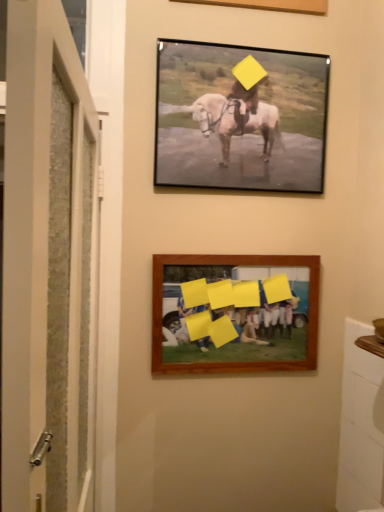
Question: From their relative heights in the image, would you say white textured door at left is taller or shorter than matte black frame at upper center, the 2th picture frame ordered from the bottom?

Choices:
 (A) tall
 (B) short

Answer: (A)

Question: Considering their positions, is white textured door at left located in front of or behind matte black frame at upper center, the 2th picture frame ordered from the bottom?

Choices:
 (A) front
 (B) behind

Answer: (A)

Question: Which of these objects is positioned farthest from the white textured door at left?

Choices:
 (A) matte black frame at upper center, the 2th picture frame ordered from the bottom
 (B) wooden frame at lower center, which appears as the 2th picture frame when viewed from the top

Answer: (A)

Question: Which of these objects is positioned closest to the wooden frame at lower center, which appears as the 2th picture frame when viewed from the top?

Choices:
 (A) matte black frame at upper center, the 2th picture frame ordered from the bottom
 (B) white textured door at left

Answer: (A)